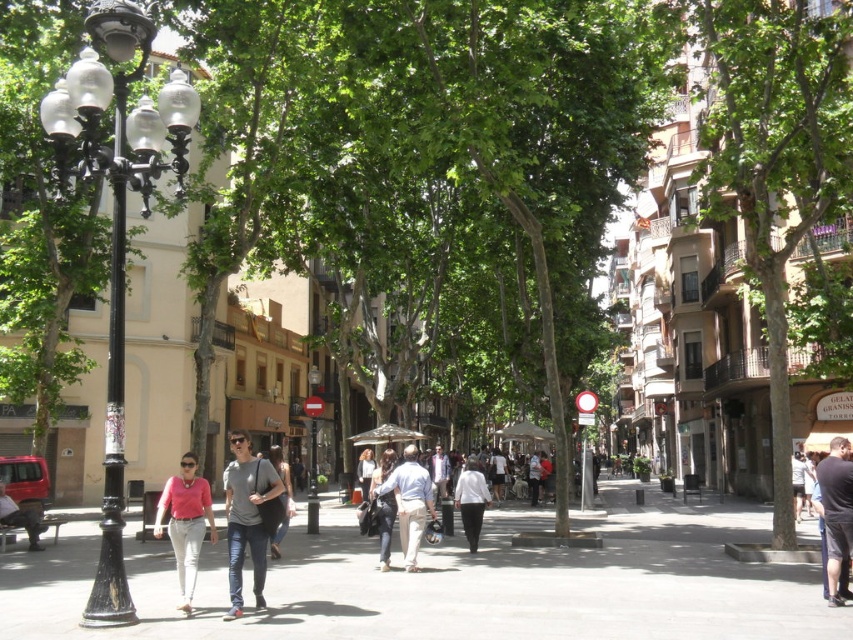
Is dark gray pants at lower right shorter than dark gray jeans at center?

Correct, dark gray pants at lower right is not as tall as dark gray jeans at center.

Does point (828, 458) lie behind point (285, 522)?

No, it is not.

Does point (839, 522) come in front of point (276, 557)?

Yes, point (839, 522) is closer to viewer.

At what (x,y) coordinates should I click in order to perform the action: click on dark gray pants at lower right. Please return your answer as a coordinate pair (x, y). The height and width of the screenshot is (640, 853). Looking at the image, I should click on (836, 512).

Between point (265, 460) and point (849, 444), which one is positioned behind?

Point (849, 444)

What do you see at coordinates (247, 516) in the screenshot?
I see `gray cotton t-shirt at center` at bounding box center [247, 516].

At what (x,y) coordinates should I click in order to perform the action: click on gray cotton t-shirt at center. Please return your answer as a coordinate pair (x, y). The image size is (853, 640). Looking at the image, I should click on (247, 516).

Between point (308, 378) and point (36, 513), which one is positioned in front?

Point (36, 513)

Which of these two, black metal lamp post at center or denim pants at lower left, stands shorter?

denim pants at lower left

Between point (310, 496) and point (32, 524), which one is positioned in front?

Point (32, 524) is in front.

Where is `black metal lamp post at center`? The height and width of the screenshot is (640, 853). black metal lamp post at center is located at coordinates (312, 449).